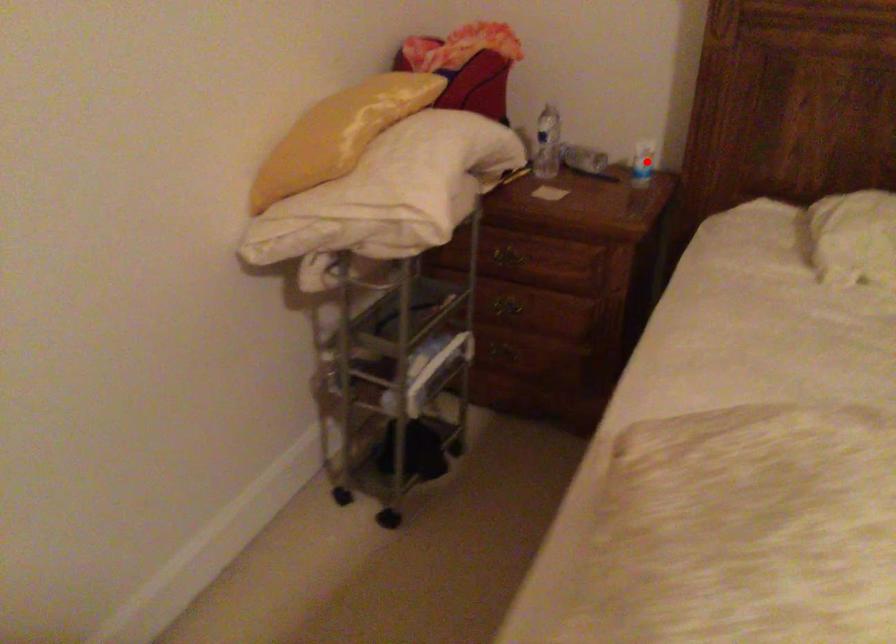
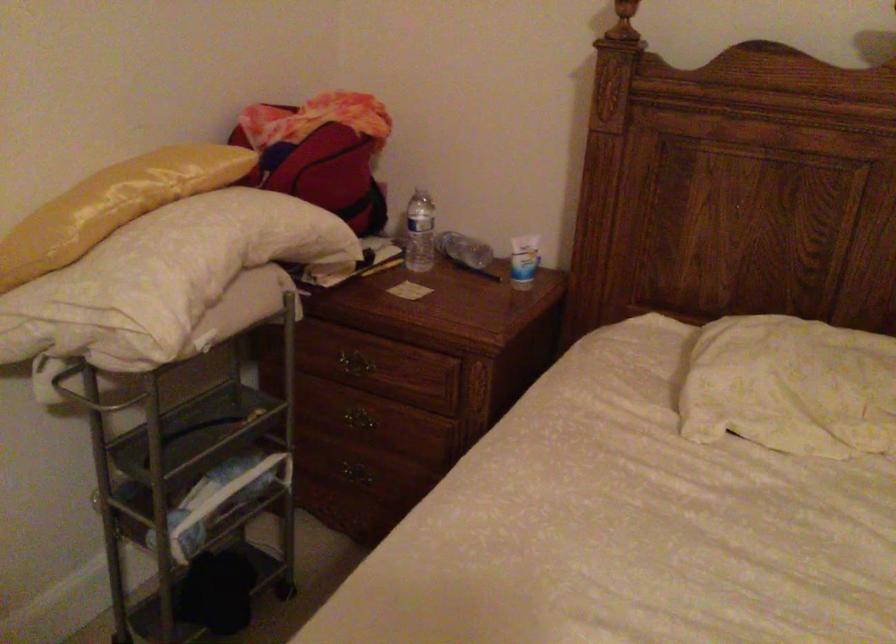
In the second image, find the point that corresponds to the highlighted location in the first image.

(523, 261)